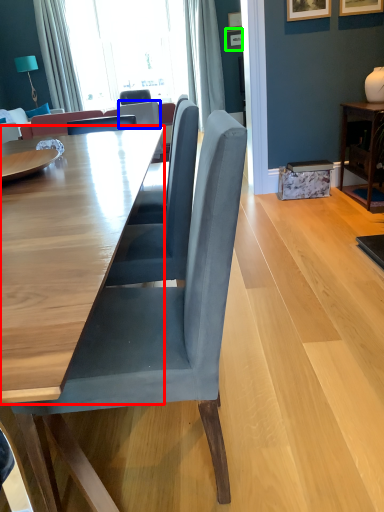
Question: Based on their relative distances, which object is nearer to table (highlighted by a red box)? Choose from chair (highlighted by a blue box) and picture frame (highlighted by a green box).

Choices:
 (A) chair
 (B) picture frame

Answer: (A)